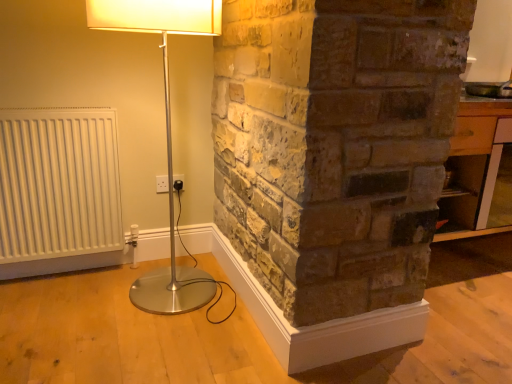
Describe the element at coordinates (58, 184) in the screenshot. Image resolution: width=512 pixels, height=384 pixels. I see `white matte radiator at left` at that location.

Measure the distance between silver metallic floor lamp at left and camera.

silver metallic floor lamp at left and camera are 4.17 feet apart.

Identify the location of silver metallic floor lamp at left. (166, 133).

At what (x,y) coordinates should I click in order to perform the action: click on white matte radiator at left. Please return your answer as a coordinate pair (x, y). The height and width of the screenshot is (384, 512). Looking at the image, I should click on [x=58, y=184].

Considering the relative sizes of silver metallic floor lamp at left and white matte radiator at left in the image provided, is silver metallic floor lamp at left taller than white matte radiator at left?

Indeed, silver metallic floor lamp at left has a greater height compared to white matte radiator at left.

Is silver metallic floor lamp at left bigger than white matte radiator at left?

Indeed, silver metallic floor lamp at left has a larger size compared to white matte radiator at left.

Which is farther from the camera, (158, 313) or (84, 224)?

The point (84, 224) is farther from the camera.

Can white plastic electric outlet at center be found inside silver metallic floor lamp at left?

No.

How many degrees apart are the facing directions of silver metallic floor lamp at left and white plastic electric outlet at center?

The angle between the facing direction of silver metallic floor lamp at left and the facing direction of white plastic electric outlet at center is 0.51 degrees.

Is silver metallic floor lamp at left oriented towards white plastic electric outlet at center?

No, silver metallic floor lamp at left is not facing towards white plastic electric outlet at center.

From a real-world perspective, who is located lower, silver metallic floor lamp at left or white plastic electric outlet at center?

white plastic electric outlet at center.

Does white matte radiator at left appear on the right side of wooden table at right?

No, white matte radiator at left is not to the right of wooden table at right.

Identify the location of table lying behind the white matte radiator at left. The image size is (512, 384). (478, 171).

From the image's perspective, which is above, white matte radiator at left or wooden table at right?

From the image's view, wooden table at right is above.

In terms of size, does wooden table at right appear bigger or smaller than white plastic electric outlet at center?

wooden table at right is bigger than white plastic electric outlet at center.

How far apart are wooden table at right and white plastic electric outlet at center?

wooden table at right is 1.54 meters from white plastic electric outlet at center.

Which is more to the right, wooden table at right or white plastic electric outlet at center?

wooden table at right.

Looking at this image, can you confirm if wooden table at right is wider than white plastic electric outlet at center?

Correct, the width of wooden table at right exceeds that of white plastic electric outlet at center.

Is point (56, 143) behind point (170, 255)?

That is False.

Is white matte radiator at left wider than silver metallic floor lamp at left?

No.

Is white matte radiator at left looking in the opposite direction of silver metallic floor lamp at left?

white matte radiator at left is not turned away from silver metallic floor lamp at left.

Visually, is white matte radiator at left positioned to the left or to the right of silver metallic floor lamp at left?

Clearly, white matte radiator at left is on the left of silver metallic floor lamp at left in the image.

Is wooden table at right aimed at white matte radiator at left?

No, wooden table at right does not turn towards white matte radiator at left.

Is wooden table at right not close to white matte radiator at left?

Yes, wooden table at right is far from white matte radiator at left.

From the picture: Does wooden table at right come in front of white matte radiator at left?

No, it is not.

Is wooden table at right bigger or smaller than white matte radiator at left?

Clearly, wooden table at right is larger in size than white matte radiator at left.

From the picture: Is white matte radiator at left completely or partially outside of white plastic electric outlet at center?

Indeed, white matte radiator at left is completely outside white plastic electric outlet at center.

Is point (51, 111) positioned before point (164, 186)?

Yes, point (51, 111) is closer to viewer.

Is white matte radiator at left aimed at white plastic electric outlet at center?

No, white matte radiator at left is not facing towards white plastic electric outlet at center.

At what (x,y) coordinates should I click in order to perform the action: click on lamp lying above the white matte radiator at left (from the image's perspective). Please return your answer as a coordinate pair (x, y). Looking at the image, I should click on (166, 133).

This screenshot has width=512, height=384. I want to click on lamp on the right of white plastic electric outlet at center, so click(x=166, y=133).

Considering their positions, is silver metallic floor lamp at left positioned further to white matte radiator at left than wooden table at right?

The object further to white matte radiator at left is wooden table at right.

In the scene shown: Which object lies nearer to the anchor point white plastic electric outlet at center, white matte radiator at left or silver metallic floor lamp at left?

Based on the image, white matte radiator at left appears to be nearer to white plastic electric outlet at center.

Looking at the image, which one is located further to silver metallic floor lamp at left, white plastic electric outlet at center or wooden table at right?

wooden table at right.

Which object lies further to the anchor point wooden table at right, silver metallic floor lamp at left or white matte radiator at left?

white matte radiator at left.

Based on their spatial positions, is wooden table at right or white matte radiator at left closer to white plastic electric outlet at center?

The object closer to white plastic electric outlet at center is white matte radiator at left.

Estimate the real-world distances between objects in this image. Which object is closer to white plastic electric outlet at center, wooden table at right or silver metallic floor lamp at left?

Among the two, silver metallic floor lamp at left is located nearer to white plastic electric outlet at center.

Looking at the image, which one is located closer to silver metallic floor lamp at left, white matte radiator at left or white plastic electric outlet at center?

white matte radiator at left.

When comparing their distances from wooden table at right, does white plastic electric outlet at center or white matte radiator at left seem further?

Among the two, white matte radiator at left is located further to wooden table at right.

What are the coordinates of `lamp between white matte radiator at left and wooden table at right in the horizontal direction` in the screenshot? It's located at (166, 133).

Locate an element on the screen. The image size is (512, 384). electric outlet between white matte radiator at left and wooden table at right from left to right is located at coordinates 162,184.

You are a GUI agent. You are given a task and a screenshot of the screen. Output one action in this format:
    pyautogui.click(x=<x>, y=<y>)
    Task: Click on the lamp between white plastic electric outlet at center and wooden table at right in the horizontal direction
    The height and width of the screenshot is (384, 512).
    Given the screenshot: What is the action you would take?
    pyautogui.click(x=166, y=133)

At what (x,y) coordinates should I click in order to perform the action: click on radiator between silver metallic floor lamp at left and white plastic electric outlet at center along the z-axis. Please return your answer as a coordinate pair (x, y). Looking at the image, I should click on (58, 184).